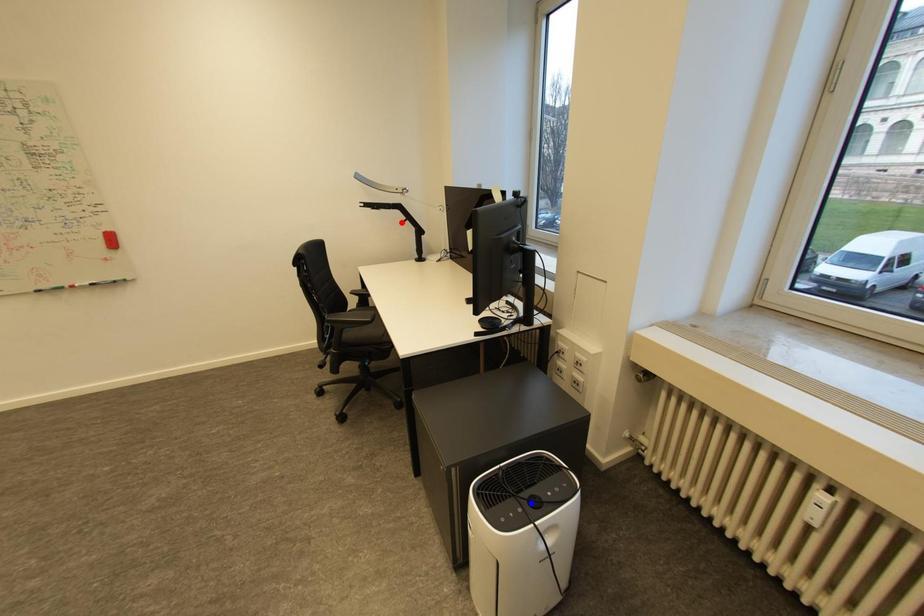
Question: In the image, two points are highlighted. Which point is nearer to the camera? Reply with the corresponding letter.

Choices:
 (A) blue point
 (B) red point

Answer: (A)